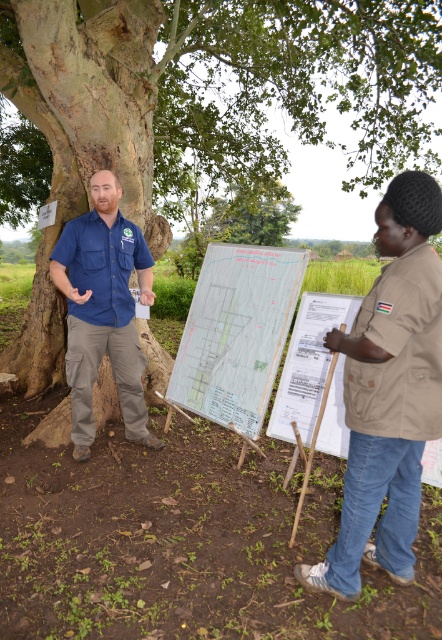
Based on the coordinates given, which object does the point at (388,392) correspond to?

The point at (388,392) corresponds to the brown fabric shirt at right.

You are a hiker who needs to check the white paper map at center to navigate. The brown rough tree at left is blocking your view. Can you move around the tree to see the map clearly?

The white paper map at center is behind the brown rough tree at left, so moving around the tree might allow you to see the map clearly.

You are a delivery person who needs to place a 30 inch wide package between the white paper map at center and the matte blue shirt at left. Can you fit it there?

The distance between the white paper map at center and the matte blue shirt at left is 32.65 inches, so yes, the 30 inch wide package can fit between them.